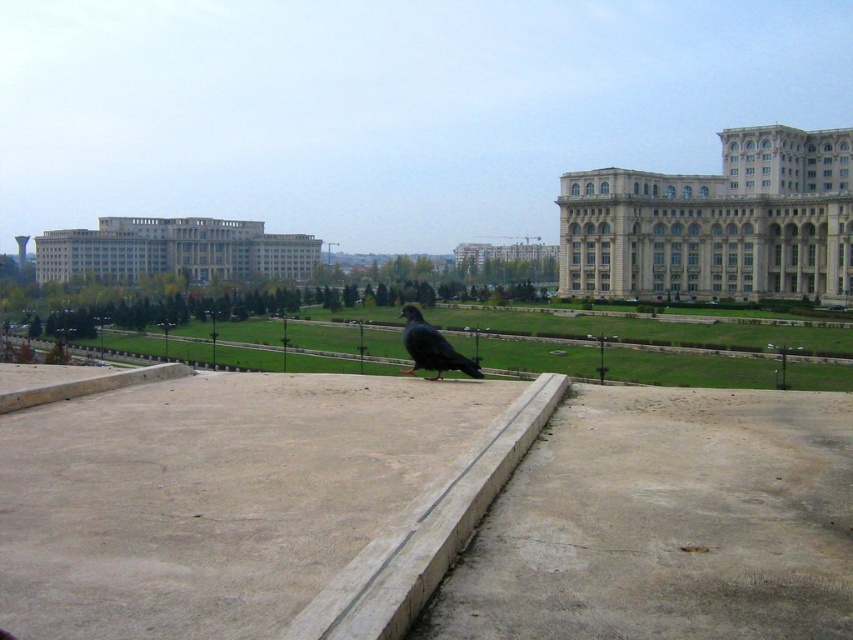
Question: Is green grass at center further to camera compared to gray stone building at center?

Choices:
 (A) no
 (B) yes

Answer: (A)

Question: Which is farther from the shiny black bird at center?

Choices:
 (A) matte gray building at center
 (B) white stone building at upper right
 (C) brown concrete at center

Answer: (A)

Question: Which of the following is the closest to the observer?

Choices:
 (A) (497, 253)
 (B) (463, 368)

Answer: (B)

Question: Can you confirm if brown concrete at center is thinner than green grass at center?

Choices:
 (A) yes
 (B) no

Answer: (A)

Question: Which of the following is the closest to the observer?

Choices:
 (A) brown concrete at center
 (B) gray stone building at center
 (C) shiny black bird at center
 (D) gray concrete at center

Answer: (D)

Question: Where is gray concrete at center located in relation to white stone building at upper right in the image?

Choices:
 (A) below
 (B) above

Answer: (A)